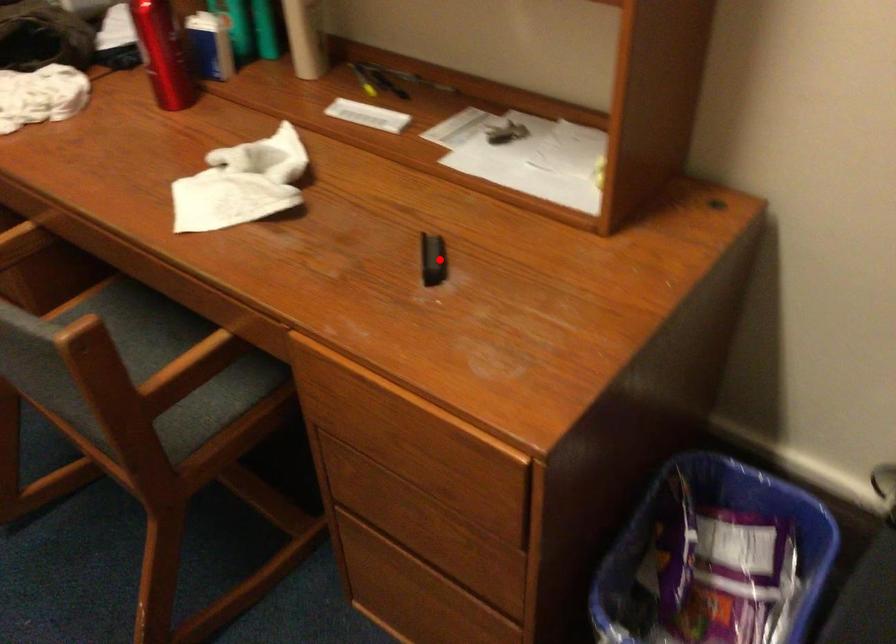
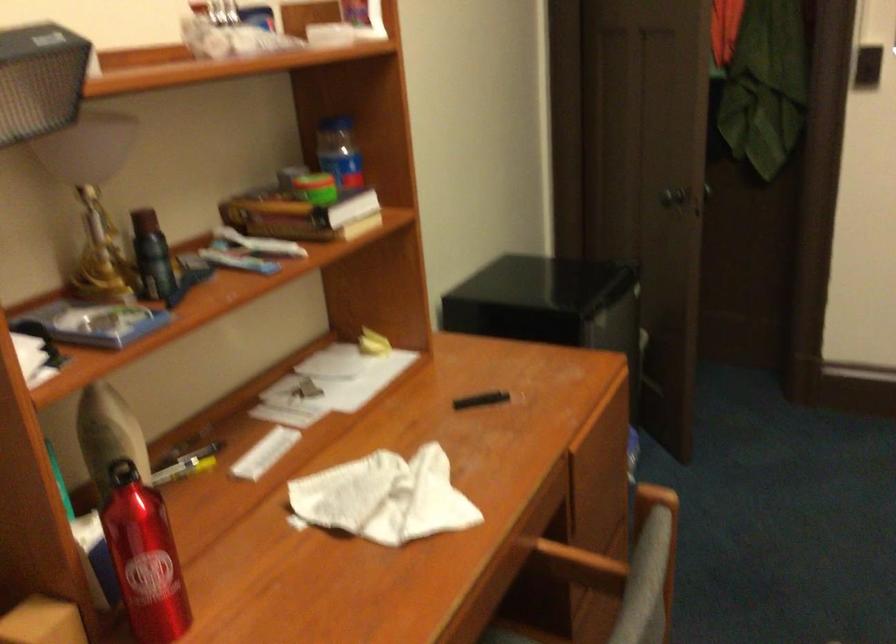
Question: I am providing you with two images of the same scene from different viewpoints. Image1 has a red point marked. In image2, the corresponding 3D location appears at what relative position? Reply with the corresponding letter.

Choices:
 (A) Closer
 (B) Farther

Answer: (B)